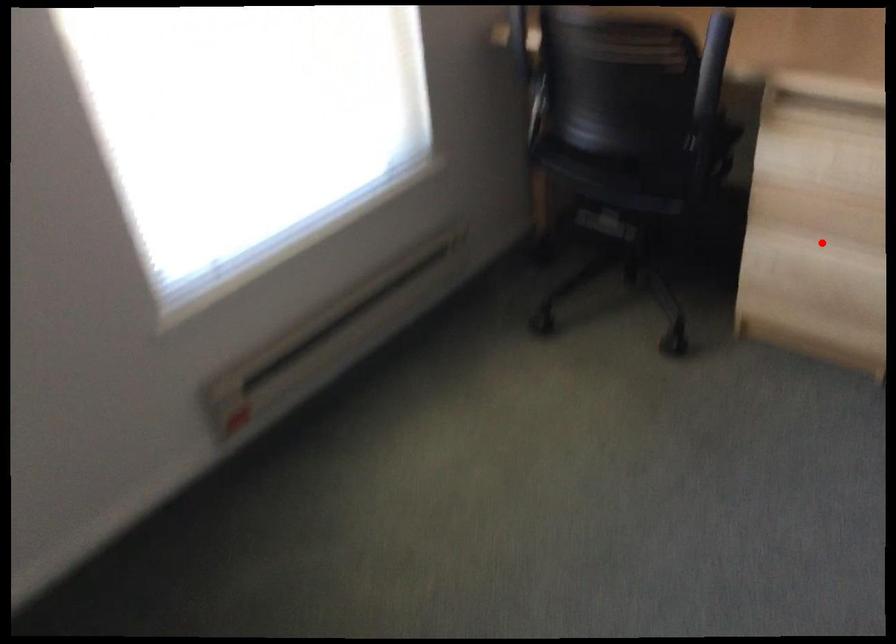
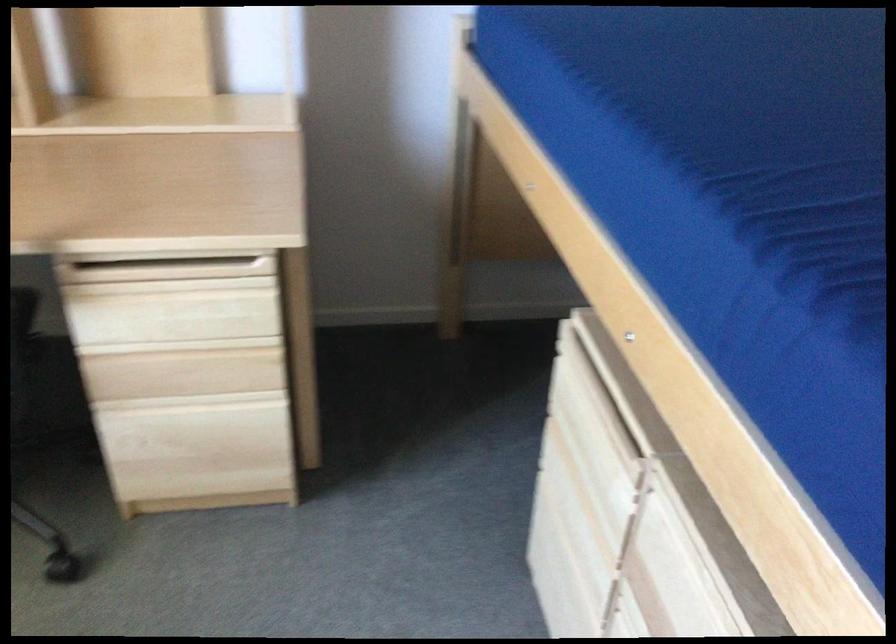
Locate, in the second image, the point that corresponds to the highlighted location in the first image.

(192, 401)